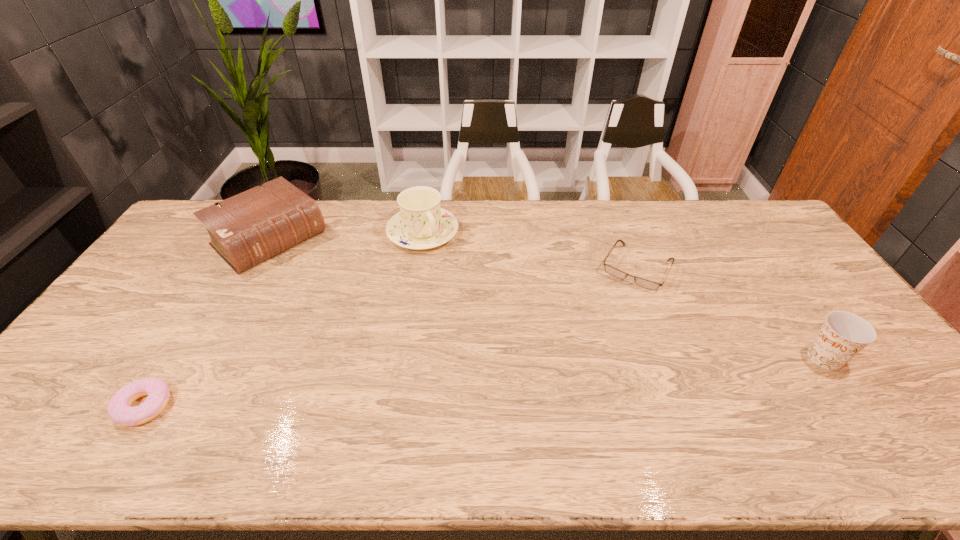
Locate an element on the screen. This screenshot has height=540, width=960. vacant position located 0.280m on the handle side of the third object from right to left is located at coordinates (477, 306).

Locate an element on the screen. This screenshot has width=960, height=540. vacant space situated 0.130m on the front-facing side of the spectacles is located at coordinates (610, 318).

Locate an element on the screen. The image size is (960, 540). vacant space located 0.190m on the front-facing side of the spectacles is located at coordinates (602, 331).

Locate an element on the screen. The width and height of the screenshot is (960, 540). free spot located 0.110m on the front-facing side of the spectacles is located at coordinates (612, 313).

Identify the location of free space located on the spine side of the Bible. The image size is (960, 540). (356, 319).

This screenshot has height=540, width=960. In order to click on blank space located on the spine side of the Bible in this screenshot , I will do click(x=332, y=296).

This screenshot has width=960, height=540. Find the location of `free region located on the spine side of the Bible`. free region located on the spine side of the Bible is located at coordinates (328, 293).

I want to click on chinaware that is at the far edge, so click(x=421, y=224).

Identify the location of Bible that is at the far edge. This screenshot has height=540, width=960. (249, 228).

Identify the location of object present at the near edge. This screenshot has width=960, height=540. (119, 409).